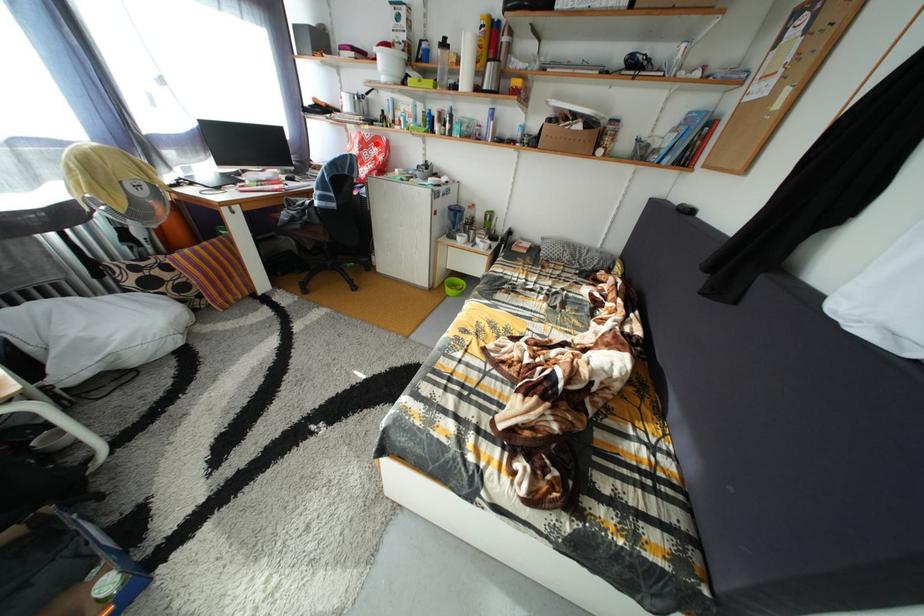
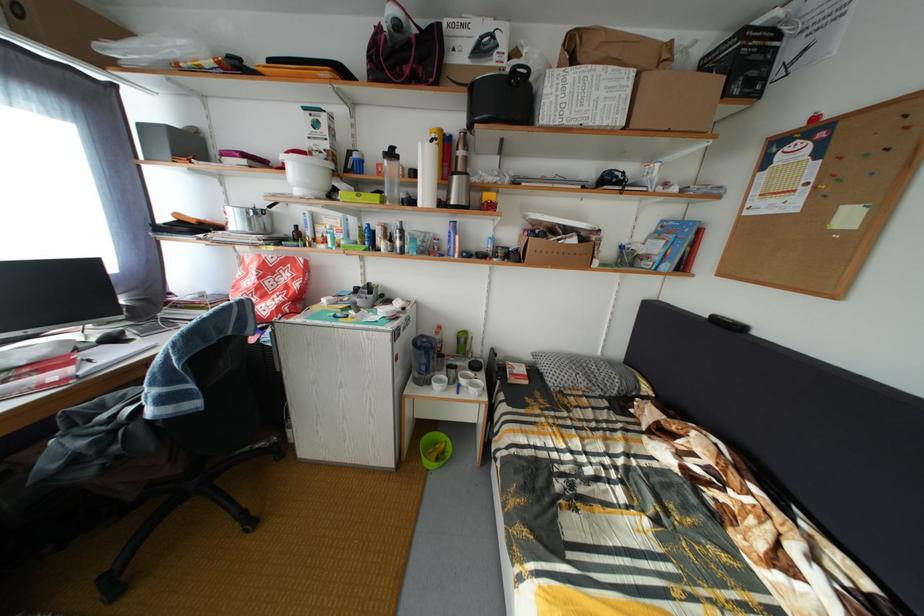
Question: I am providing you with two images of the same scene from different viewpoints. Image1 has a red point marked. In image2, the corresponding 3D location appears at what relative position? Reply with the corresponding letter.

Choices:
 (A) Closer
 (B) Farther

Answer: (B)